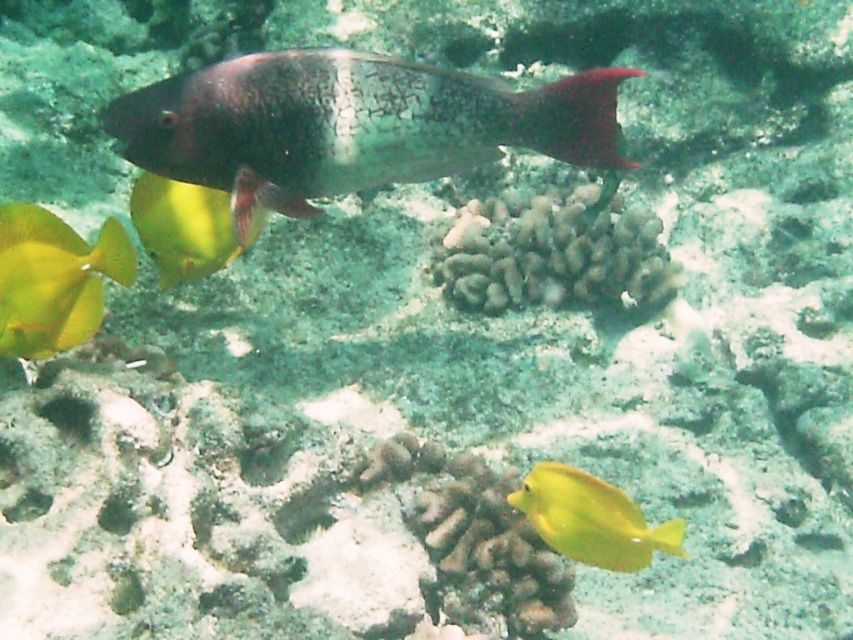
You are a marine biologist observing the underwater scene. You notice a speckled silver fish at center marked by point (351, 125). What is the position of the speckled silver fish at center relative to the two yellow fish in the foreground?

The speckled silver fish at center marked by point (351, 125) is located in the midground, which is behind the two yellow fish in the foreground.

You are a diver trying to locate two points underwater. The first point is at coordinates point (605, 499) and the second point is at point (228, 220). Which point is nearer to you when you are facing the image?

Point (605, 499) is closer to the viewer than point (228, 220).

You are a marine biologist observing the underwater scene. You need to place a 6.5 inch wide net between the smooth yellow fish at left and the shiny yellow fish at lower left. Will the net fit between them without touching either fish?

The distance between the smooth yellow fish at left and the shiny yellow fish at lower left is 7.80 inches. Since the net is 6.5 inches wide, it can fit between them as the space is larger than the net.